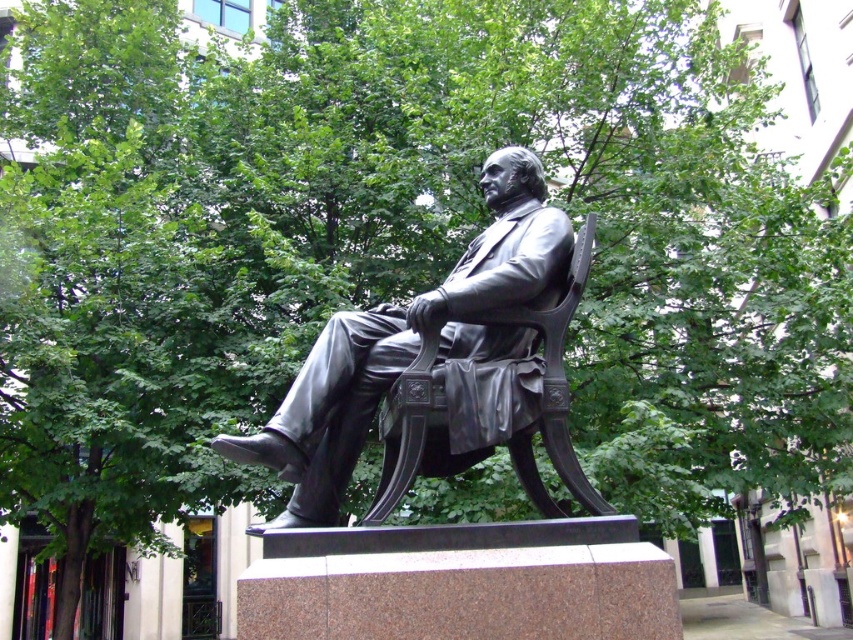
You are standing in front of the statue and want to take a photo of it. If you move 0.1 units to the right and 0.05 units up from your current position, will you still be facing the polished bronze statue at center?

The 2D location of the polished bronze statue at center is at point (403,342). Moving 0.1 units to the right and 0.05 units up from your current position would shift your position to the right and upwards. Since the statue is at the center, moving in those directions might take you away from facing it directly. However, without knowing your original position, it is impossible to determine if you would still be facing the statue.

You are standing in front of the bronze statue of the seated man. There are two points marked on the statue. The first point is at coordinates point (527, 301) and the second point is at point (585, 260). Which point is closer to you?

Point (527, 301) is further to the camera than point (585, 260), so the point closer to you is point (585, 260).